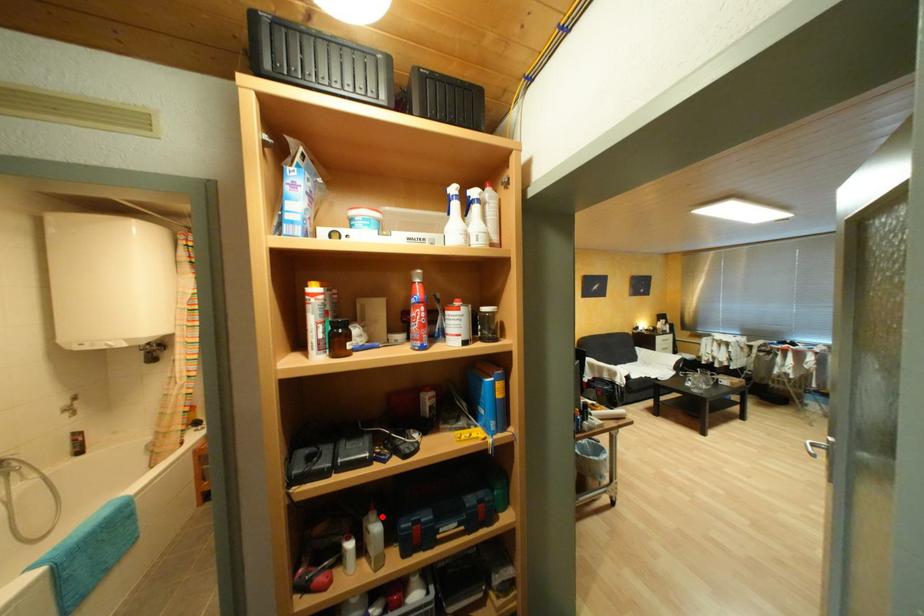
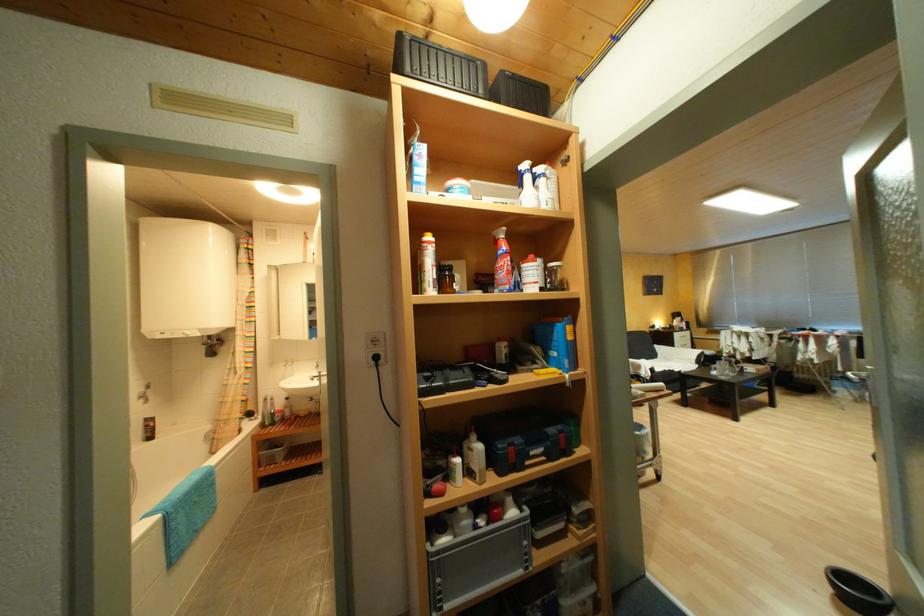
In the second image, find the point that corresponds to the highlighted location in the first image.

(482, 438)